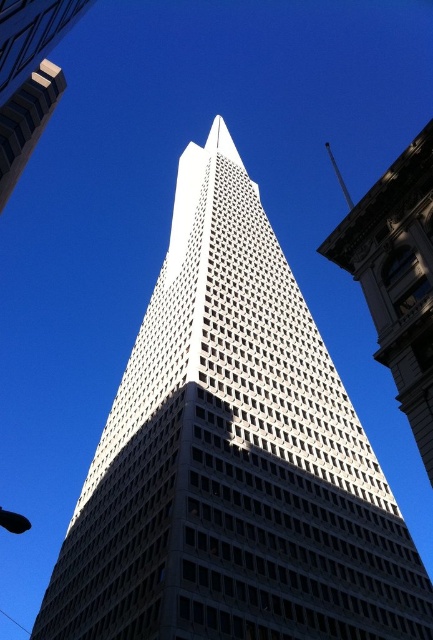
Looking at this image, you are a photographer standing in the park and want to capture the white glass skyscraper at center and the white glass skyscraper at upper left in a single shot. Which skyscraper will appear smaller in your photo?

The white glass skyscraper at upper left will appear smaller because it is positioned behind the white glass skyscraper at center, making it farther away from the camera and thus appearing smaller in the photo.

You are a photographer standing in the park across from the Transamerica Pyramid. You want to capture both the white glass skyscraper at center and the white glass skyscraper at upper left in your shot. Which skyscraper will appear taller in your photo?

The white glass skyscraper at center will appear taller in the photo since it has a greater height compared to the white glass skyscraper at upper left.

You are standing in front of the Transamerica Pyramid and see the white glass skyscraper at center and the white glass skyscraper at upper left. Which one appears nearer to you?

The white glass skyscraper at center is closer to the viewer than the white glass skyscraper at upper left.